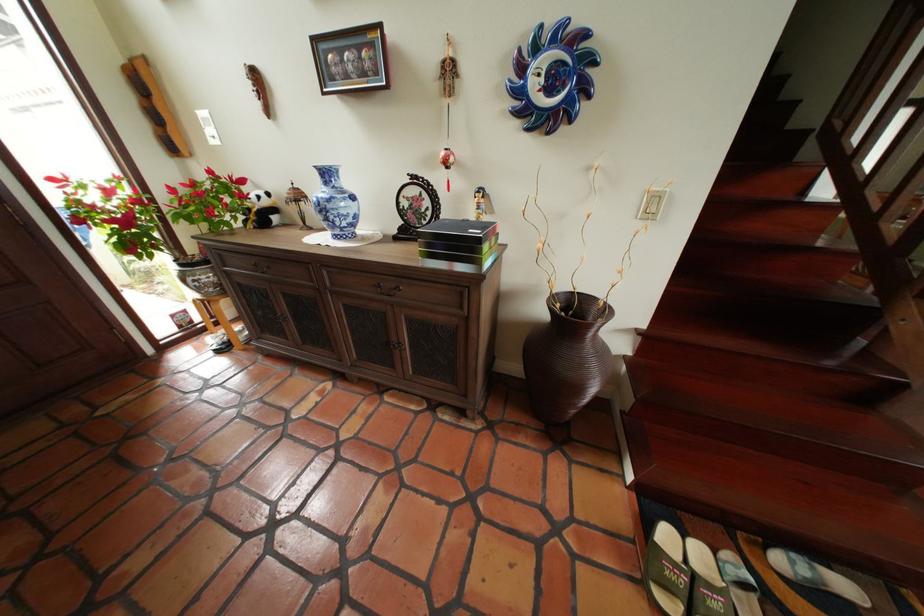
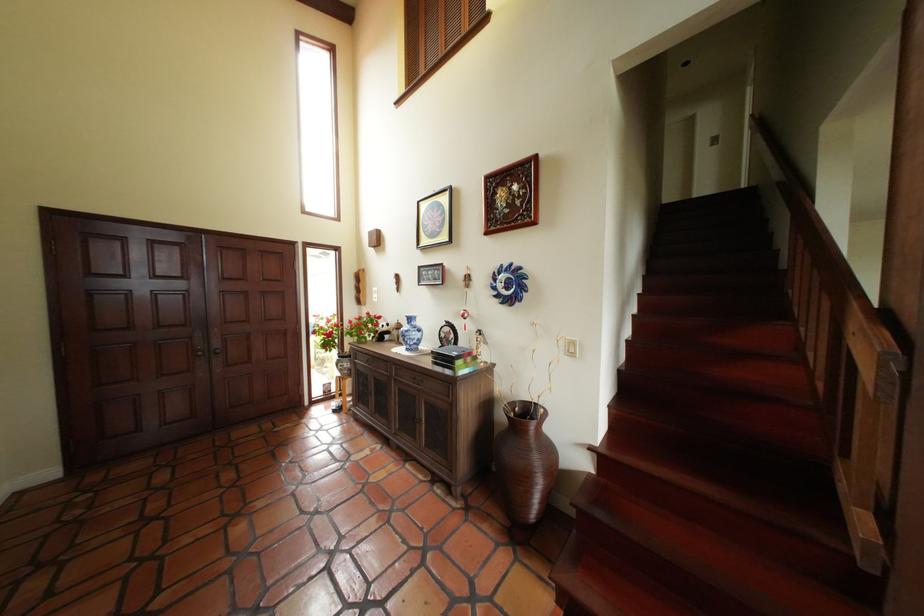
Find the pixel in the second image that matches point 238,273 in the first image.

(368, 363)